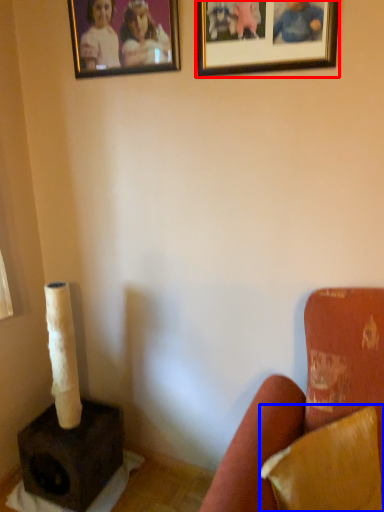
Question: Which object appears farthest to the camera in this image, picture frame (highlighted by a red box) or pillow (highlighted by a blue box)?

Choices:
 (A) picture frame
 (B) pillow

Answer: (A)